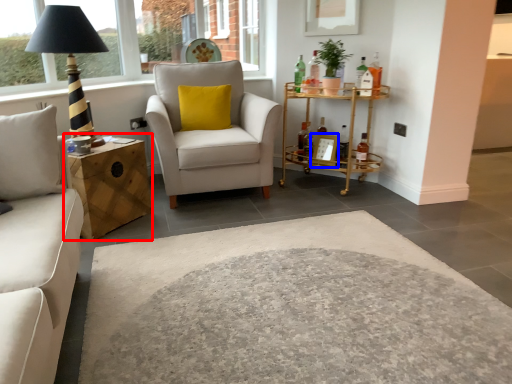
Question: Which of the following is the closest to the observer, nightstand (highlighted by a red box) or picture frame (highlighted by a blue box)?

Choices:
 (A) nightstand
 (B) picture frame

Answer: (A)